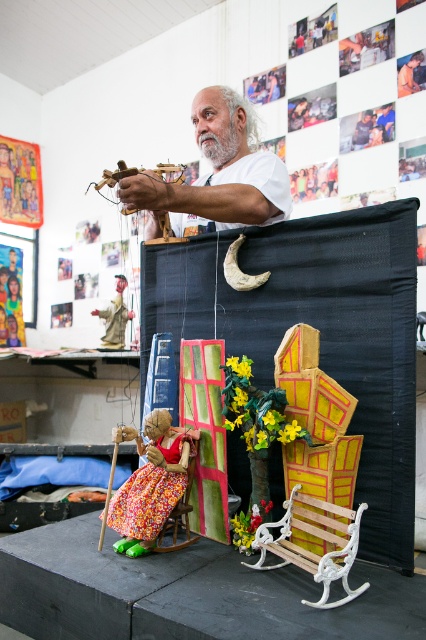
You are standing in front of the puppet show stage and notice two points marked on the backdrop. The first point is at coordinate (285,209) and the second is at (339,554). Which point is closer to the front of the stage?

Point (339,554) is closer to the front of the stage because it is in front of point (285,209).

You are a puppeteer setting up for a show. You need to place a small puppet on the stage. The puppet is exactly at the point marked by the coordinate point (178, 518). What object is located at that point?

The point (178, 518) marks the location of the floral fabric rocking chair at lower left.

Based on the photo, you are an event planner setting up for a puppet show. You need to ensure that the white matte man at upper center and the wooden bench at lower right are visible to the audience. Given their sizes, which object might block the view of the other if placed directly in front?

The white matte man at upper center is larger in size than the wooden bench at lower right, so if placed directly in front, it could block the view of the wooden bench at lower right.